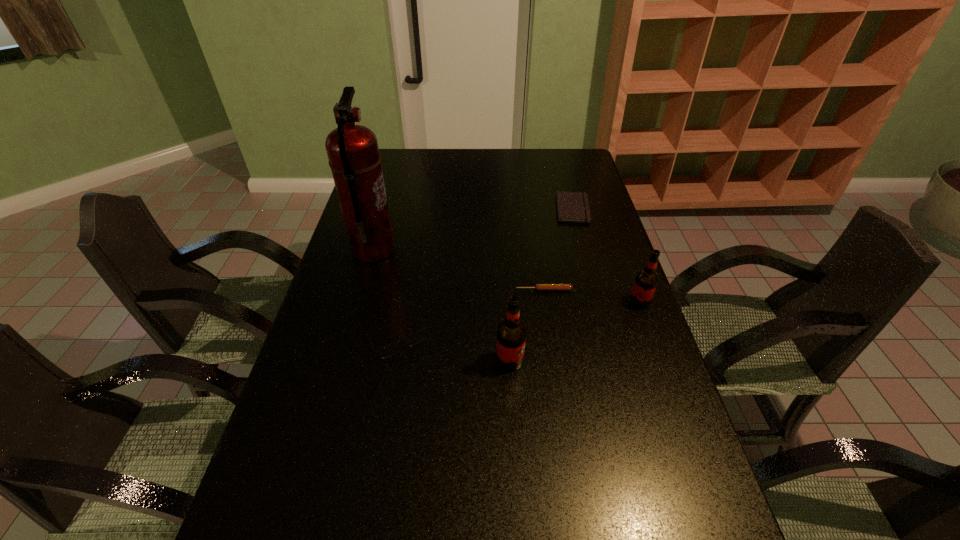
I want to click on vacant area between the shortest object and the third shortest object, so click(x=485, y=274).

The width and height of the screenshot is (960, 540). In order to click on vacant region between the nearer root beer and the second shortest object in this screenshot , I will do `click(527, 325)`.

The image size is (960, 540). Find the location of `free space between the sausage and the taller root beer`. free space between the sausage and the taller root beer is located at coordinates (527, 325).

The height and width of the screenshot is (540, 960). Find the location of `free space between the tallest object and the taller root beer`. free space between the tallest object and the taller root beer is located at coordinates (442, 305).

Image resolution: width=960 pixels, height=540 pixels. I want to click on free space between the fifth tallest object and the shorter root beer, so click(x=591, y=296).

The image size is (960, 540). In order to click on free space that is in between the sausage and the left root beer in this screenshot , I will do `click(527, 325)`.

I want to click on unoccupied position between the second object from right to left and the tallest object, so click(473, 230).

Select which object appears as the closest to the fourth nearest object. Please provide its 2D coordinates. Your answer should be formatted as a tuple, i.e. [(x, y)], where the tuple contains the x and y coordinates of a point satisfying the conditions above.

[(646, 280)]

Choose which object is the fourth nearest neighbor to the fire extinguisher. Please provide its 2D coordinates. Your answer should be formatted as a tuple, i.e. [(x, y)], where the tuple contains the x and y coordinates of a point satisfying the conditions above.

[(573, 207)]

Identify the location of vacant space that satisfies the following two spatial constraints: 1. on the nozzle side of the second farthest object; 2. on the back side of the second shortest object. This screenshot has width=960, height=540. (362, 290).